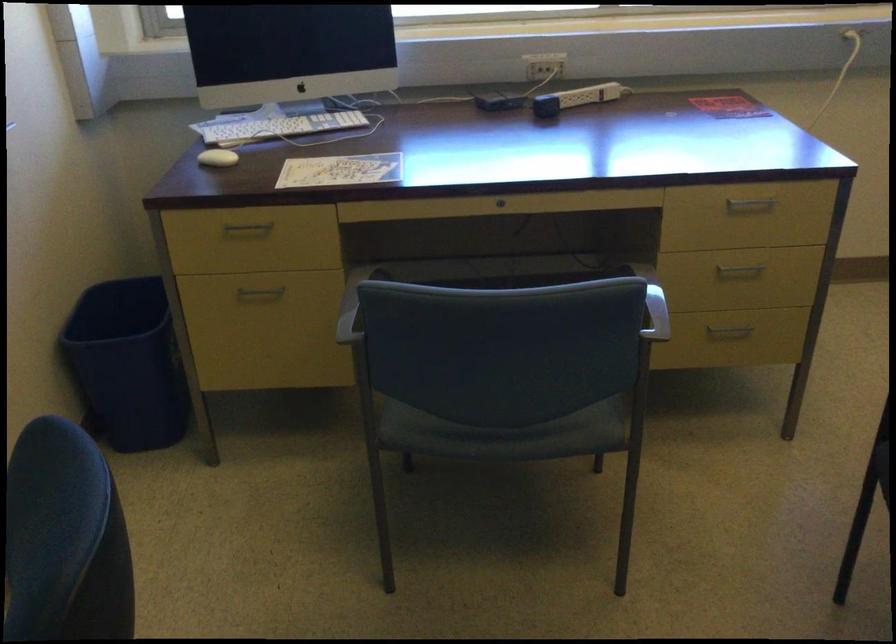
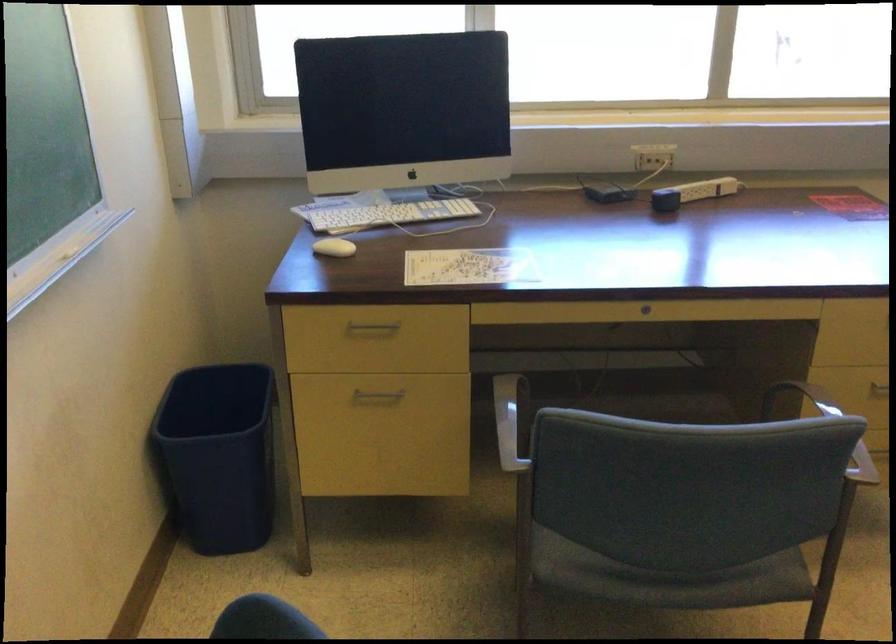
Question: I am providing you with two images of the same scene from different viewpoints. After the viewpoint changes to image2, which objects are now occluded?

Choices:
 (A) wall outlet
 (B) chair sitting surface
 (C) small black cube
 (D) none of these

Answer: (D)